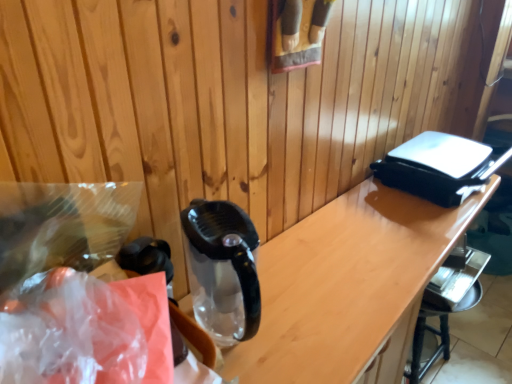
Identify the location of translucent plastic bag at left. The width and height of the screenshot is (512, 384). (88, 334).

Identify the location of metallic silver bar stool at lower right. (446, 303).

Find the location of a particular element. translucent plastic bag at left is located at coordinates (88, 334).

Consider the image. Is metallic silver bar stool at lower right shorter than transparent glass table at center?

Yes.

Would you say metallic silver bar stool at lower right is to the left or to the right of transparent glass table at center in the picture?

From the image, it's evident that metallic silver bar stool at lower right is to the right of transparent glass table at center.

Could you tell me if metallic silver bar stool at lower right is facing transparent glass table at center?

Yes, metallic silver bar stool at lower right is aimed at transparent glass table at center.

From a real-world perspective, is transparent plastic bag at left positioned above or below transparent glass table at center?

In terms of real-world spatial position, transparent plastic bag at left is above transparent glass table at center.

Based on the photo, is transparent plastic bag at left wider than transparent glass table at center?

Indeed, transparent plastic bag at left has a greater width compared to transparent glass table at center.

Is there a large distance between transparent plastic bag at left and transparent glass table at center?

transparent plastic bag at left is near transparent glass table at center, not far away.

Considering the points (405, 281) and (72, 206), which point is in front, point (405, 281) or point (72, 206)?

The point (72, 206) is in front.

Is transparent glass table at center taller than transparent plastic bag at left?

Yes.

In the scene shown: From the image's perspective, is transparent glass table at center under transparent plastic bag at left?

Indeed, from the image's perspective, transparent glass table at center is shown beneath transparent plastic bag at left.

Considering their positions, is transparent glass table at center located in front of or behind transparent plastic bag at left?

transparent glass table at center is positioned farther from the viewer than transparent plastic bag at left.

Can you tell me how much translucent plastic bag at left and transparent plastic bag at left differ in facing direction?

7.13 degrees.

Where is `waste that appears on the left of translucent plastic bag at left`? The image size is (512, 384). waste that appears on the left of translucent plastic bag at left is located at coordinates [x=71, y=289].

Is translucent plastic bag at left aimed at transparent plastic bag at left?

No.

Is translucent plastic bag at left taller or shorter than transparent plastic bag at left?

Considering their sizes, translucent plastic bag at left has less height than transparent plastic bag at left.

How different are the orientations of metallic silver bar stool at lower right and translucent plastic bag at left in degrees?

There is a 10.2-degree angle between the facing directions of metallic silver bar stool at lower right and translucent plastic bag at left.

Is metallic silver bar stool at lower right aimed at translucent plastic bag at left?

No, metallic silver bar stool at lower right is not facing towards translucent plastic bag at left.

Image resolution: width=512 pixels, height=384 pixels. I want to click on plastic bag on the left of metallic silver bar stool at lower right, so click(88, 334).

Is translucent plastic bag at left not close to transparent glass table at center?

Actually, translucent plastic bag at left and transparent glass table at center are a little close together.

Considering the relative positions of translucent plastic bag at left and transparent glass table at center in the image provided, is translucent plastic bag at left in front of transparent glass table at center?

Yes, translucent plastic bag at left is in front of transparent glass table at center.

Locate an element on the screen. The height and width of the screenshot is (384, 512). plastic bag to the left of transparent glass table at center is located at coordinates (88, 334).

From the image's perspective, which one is positioned higher, translucent plastic bag at left or transparent glass table at center?

translucent plastic bag at left is shown above in the image.

Consider the image. Could you tell me if transparent glass table at center is turned towards metallic silver bar stool at lower right?

Yes, transparent glass table at center is turned towards metallic silver bar stool at lower right.

Considering the positions of objects transparent glass table at center and metallic silver bar stool at lower right in the image provided, who is more to the right, transparent glass table at center or metallic silver bar stool at lower right?

Positioned to the right is metallic silver bar stool at lower right.

Which object is thinner, transparent glass table at center or metallic silver bar stool at lower right?

With smaller width is metallic silver bar stool at lower right.

From the image's perspective, between transparent glass table at center and metallic silver bar stool at lower right, who is located below?

metallic silver bar stool at lower right is shown below in the image.

At what (x,y) coordinates should I click in order to perform the action: click on table that is above the metallic silver bar stool at lower right (from the image's perspective). Please return your answer as a coordinate pair (x, y). The height and width of the screenshot is (384, 512). Looking at the image, I should click on pyautogui.click(x=348, y=286).

The width and height of the screenshot is (512, 384). Find the location of `table that is under the transparent plastic bag at left (from a real-world perspective)`. table that is under the transparent plastic bag at left (from a real-world perspective) is located at coordinates (348, 286).

Based on their spatial positions, is translucent plastic bag at left or transparent glass table at center closer to transparent plastic bag at left?

The object closer to transparent plastic bag at left is translucent plastic bag at left.

Estimate the real-world distances between objects in this image. Which object is further from translucent plastic bag at left, transparent plastic bag at left or transparent glass table at center?

The object further to translucent plastic bag at left is transparent glass table at center.

When comparing their distances from translucent plastic bag at left, does transparent glass table at center or transparent plastic bag at left seem further?

transparent glass table at center.

Based on their spatial positions, is transparent plastic bag at left or metallic silver bar stool at lower right closer to translucent plastic bag at left?

transparent plastic bag at left lies closer to translucent plastic bag at left than the other object.

Which object lies further to the anchor point metallic silver bar stool at lower right, transparent glass table at center or transparent plastic bag at left?

Among the two, transparent plastic bag at left is located further to metallic silver bar stool at lower right.

Looking at the image, which one is located further to metallic silver bar stool at lower right, translucent plastic bag at left or transparent plastic bag at left?

translucent plastic bag at left is positioned further to the anchor metallic silver bar stool at lower right.

Estimate the real-world distances between objects in this image. Which object is closer to metallic silver bar stool at lower right, transparent plastic bag at left or translucent plastic bag at left?

transparent plastic bag at left.

When comparing their distances from metallic silver bar stool at lower right, does transparent glass table at center or translucent plastic bag at left seem further?

Based on the image, translucent plastic bag at left appears to be further to metallic silver bar stool at lower right.

Locate an element on the screen. The width and height of the screenshot is (512, 384). plastic bag between transparent plastic bag at left and metallic silver bar stool at lower right from left to right is located at coordinates (88, 334).

The height and width of the screenshot is (384, 512). In order to click on table between translucent plastic bag at left and metallic silver bar stool at lower right from front to back in this screenshot , I will do (x=348, y=286).

Locate an element on the screen. The height and width of the screenshot is (384, 512). table between transparent plastic bag at left and metallic silver bar stool at lower right in the horizontal direction is located at coordinates (348, 286).

The image size is (512, 384). I want to click on plastic bag between transparent plastic bag at left and transparent glass table at center from left to right, so click(88, 334).